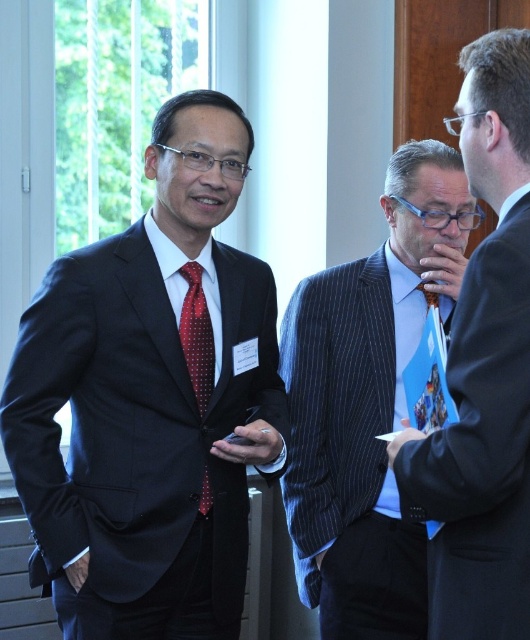
Is point (381, 348) in front of point (448, 541)?

That is False.

Is blue pinstripe suit at center shorter than blue silk tie at center?

No.

Who is more forward, (391, 396) or (516, 124)?

Positioned in front is point (516, 124).

The height and width of the screenshot is (640, 530). Identify the location of blue pinstripe suit at center. (367, 401).

Which is behind, point (210, 321) or point (498, 332)?

The point (210, 321) is behind.

Can you confirm if matte black suit at left is bigger than blue silk tie at center?

Indeed, matte black suit at left has a larger size compared to blue silk tie at center.

Which is behind, point (75, 620) or point (465, 58)?

Positioned behind is point (75, 620).

The image size is (530, 640). I want to click on matte black suit at left, so click(x=151, y=400).

Does matte black suit at left have a greater width compared to red dotted silk tie at center?

Yes, matte black suit at left is wider than red dotted silk tie at center.

Is matte black suit at left above red dotted silk tie at center?

Yes, matte black suit at left is above red dotted silk tie at center.

This screenshot has height=640, width=530. I want to click on matte black suit at left, so click(151, 400).